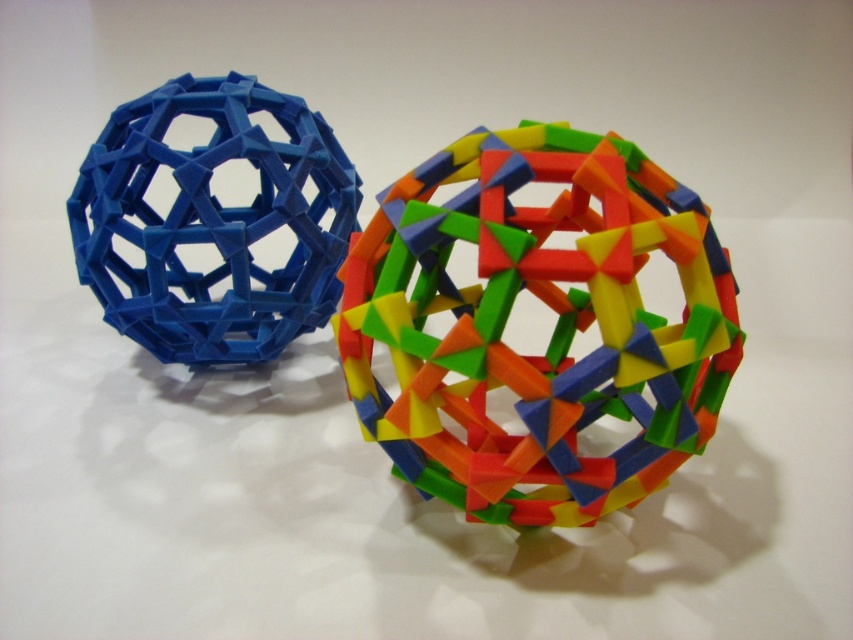
You are an artist planning to paint a still life of the multicolored plastic geometric ball at center and the matte blue plastic sphere at left. You want to ensure proper lighting to highlight their geometric details. Since the spheres are positioned in a way that one might cast a shadow on the other, which sphere should you position closer to the light source to prevent shadow overlap?

The multicolored plastic geometric ball at center is positioned under the matte blue plastic sphere at left. To prevent shadow overlap, you should position the matte blue plastic sphere at left closer to the light source so its shadow does not fall on the multicolored plastic geometric ball at center.

You are a delivery robot with a 12 inch wide arm. You need to place an object between the multicolored plastic geometric ball at center and the matte blue plastic sphere at left. Can your arm fit through the space between them?

The distance between the multicolored plastic geometric ball at center and the matte blue plastic sphere at left is 15.60 inches. Since your arm is 12 inches wide, it can fit through the space between them as 12 inches is less than 15.60 inches.